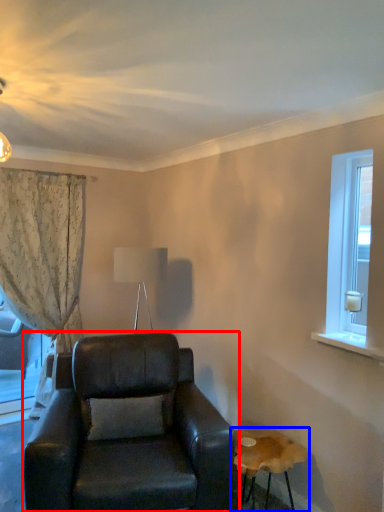
Question: Among these objects, which one is farthest to the camera, chair (highlighted by a red box) or table (highlighted by a blue box)?

Choices:
 (A) chair
 (B) table

Answer: (B)